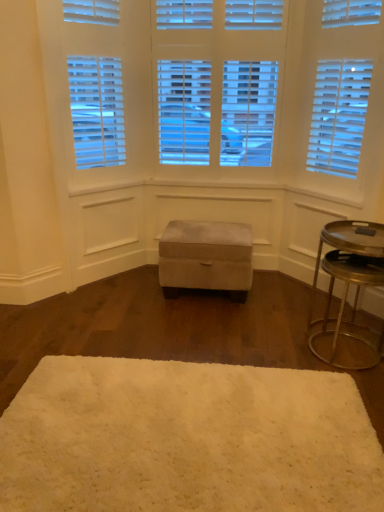
Question: Should I look upward or downward to see white fluffy rug at center?

Choices:
 (A) up
 (B) down

Answer: (B)

Question: Can white fluffy rug at center be found inside metallic gold tray at right?

Choices:
 (A) no
 (B) yes

Answer: (A)

Question: Can you confirm if metallic gold tray at right is positioned to the left of white fluffy rug at center?

Choices:
 (A) no
 (B) yes

Answer: (A)

Question: Is metallic gold tray at right bigger than white fluffy rug at center?

Choices:
 (A) no
 (B) yes

Answer: (B)

Question: Is metallic gold tray at right closer to the viewer compared to white fluffy rug at center?

Choices:
 (A) yes
 (B) no

Answer: (B)

Question: From a real-world perspective, is metallic gold tray at right located beneath white fluffy rug at center?

Choices:
 (A) yes
 (B) no

Answer: (B)

Question: Does metallic gold tray at right have a greater height compared to white fluffy rug at center?

Choices:
 (A) no
 (B) yes

Answer: (B)

Question: Is white fluffy rug at center far away from suede ottoman at center?

Choices:
 (A) no
 (B) yes

Answer: (B)

Question: Is white fluffy rug at center to the left of suede ottoman at center from the viewer's perspective?

Choices:
 (A) no
 (B) yes

Answer: (B)

Question: From the image's perspective, is white fluffy rug at center under suede ottoman at center?

Choices:
 (A) no
 (B) yes

Answer: (B)

Question: From a real-world perspective, is white fluffy rug at center on suede ottoman at center?

Choices:
 (A) yes
 (B) no

Answer: (B)

Question: Is white fluffy rug at center facing away from suede ottoman at center?

Choices:
 (A) yes
 (B) no

Answer: (B)

Question: Does white fluffy rug at center have a smaller size compared to suede ottoman at center?

Choices:
 (A) no
 (B) yes

Answer: (B)

Question: Is suede ottoman at center bigger than metallic gold tray at right?

Choices:
 (A) yes
 (B) no

Answer: (B)